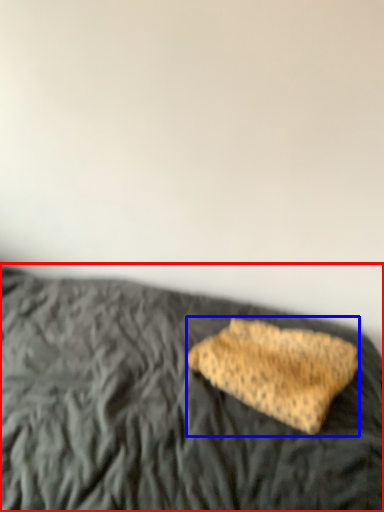
Question: Among these objects, which one is nearest to the camera, bed (highlighted by a red box) or sponge (highlighted by a blue box)?

Choices:
 (A) bed
 (B) sponge

Answer: (A)